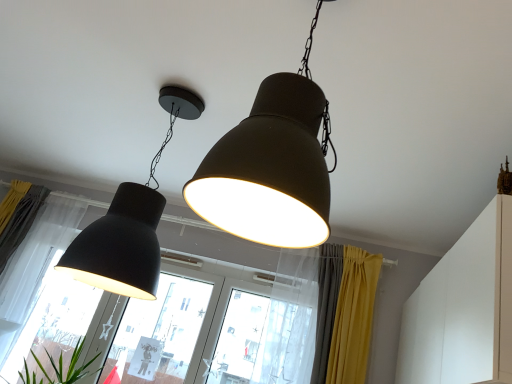
Measure the distance between point (158, 255) and camera.

The distance of point (158, 255) from camera is 3.03 meters.

This screenshot has height=384, width=512. Describe the element at coordinates (129, 223) in the screenshot. I see `matte black lampshade at left, the 1th lamp from the left` at that location.

Where is `matte black lampshade at left`? This screenshot has width=512, height=384. matte black lampshade at left is located at coordinates (161, 313).

The height and width of the screenshot is (384, 512). What are the coordinates of `white matte cabinet at upper right` in the screenshot? It's located at (463, 308).

Find the location of `white sheer curtain at left, which is the first curtain in left-to-right order`. white sheer curtain at left, which is the first curtain in left-to-right order is located at coordinates (21, 222).

The height and width of the screenshot is (384, 512). What do you see at coordinates (21, 222) in the screenshot? I see `white sheer curtain at left, arranged as the 3th curtain when viewed from the right` at bounding box center [21, 222].

Find the location of a particular element. The width and height of the screenshot is (512, 384). transparent glass window at lower left, which is counted as the third window, starting from the right is located at coordinates (52, 321).

The image size is (512, 384). Describe the element at coordinates (52, 321) in the screenshot. I see `transparent glass window at lower left, arranged as the first window when viewed from the left` at that location.

Find the location of a particular element. matte black lampshade at left, which ranks as the first lamp in back-to-front order is located at coordinates (129, 223).

From the image's perspective, is silky yellow curtain at center, the second curtain in the left-to-right sequence, located above or below white matte cabinet at upper right?

Clearly, from the image's perspective, silky yellow curtain at center, the second curtain in the left-to-right sequence, is below white matte cabinet at upper right.

Is silky yellow curtain at center, the second curtain in the left-to-right sequence, not near white matte cabinet at upper right?

Yes, silky yellow curtain at center, the second curtain in the left-to-right sequence, and white matte cabinet at upper right are quite far apart.

Which object is positioned more to the left, silky yellow curtain at center, the second curtain in the left-to-right sequence, or white matte cabinet at upper right?

silky yellow curtain at center, the second curtain in the left-to-right sequence, is more to the left.

Considering the sizes of objects silky yellow curtain at center, the second curtain in the left-to-right sequence, and white matte cabinet at upper right in the image provided, who is wider, silky yellow curtain at center, the second curtain in the left-to-right sequence, or white matte cabinet at upper right?

white matte cabinet at upper right is wider.

Is transparent glass window at center, arranged as the 3th window when viewed from the left, touching yellow fabric curtain at lower right, which is counted as the first curtain, starting from the right?

transparent glass window at center, arranged as the 3th window when viewed from the left, and yellow fabric curtain at lower right, which is counted as the first curtain, starting from the right, are clearly separated.

From a real-world perspective, is transparent glass window at center, arranged as the 3th window when viewed from the left, above or below yellow fabric curtain at lower right, which is counted as the first curtain, starting from the right?

transparent glass window at center, arranged as the 3th window when viewed from the left, is situated lower than yellow fabric curtain at lower right, which is counted as the first curtain, starting from the right, in the real world.

Considering the relative sizes of transparent glass window at center, the first window from the right, and yellow fabric curtain at lower right, arranged as the third curtain when viewed from the left, in the image provided, is transparent glass window at center, the first window from the right, taller than yellow fabric curtain at lower right, arranged as the third curtain when viewed from the left,?

No, transparent glass window at center, the first window from the right, is not taller than yellow fabric curtain at lower right, arranged as the third curtain when viewed from the left.

Considering the points (249, 347) and (355, 264), which point is in front, point (249, 347) or point (355, 264)?

The point (355, 264) is closer to the camera.

Looking at this image, between transparent glass window at center, acting as the second window starting from the left, and white matte cabinet at upper right, which one has larger width?

Wider between the two is white matte cabinet at upper right.

Are transparent glass window at center, which is the second window from right to left, and white matte cabinet at upper right far apart?

Yes, transparent glass window at center, which is the second window from right to left, and white matte cabinet at upper right are quite far apart.

Is point (169, 359) closer to viewer compared to point (473, 306)?

No, (169, 359) is behind (473, 306).

Is transparent glass window at center, acting as the second window starting from the left, to the left of white matte cabinet at upper right from the viewer's perspective?

Correct, you'll find transparent glass window at center, acting as the second window starting from the left, to the left of white matte cabinet at upper right.

Between matte black lampshade at left, the 1th lamp from the left, and yellow fabric curtain at lower right, which is counted as the first curtain, starting from the right, which one has smaller width?

yellow fabric curtain at lower right, which is counted as the first curtain, starting from the right.

Considering the points (158, 254) and (345, 364), which point is behind, point (158, 254) or point (345, 364)?

Point (158, 254)

Does matte black lampshade at left, which ranks as the first lamp in back-to-front order, have a greater height compared to yellow fabric curtain at lower right, arranged as the third curtain when viewed from the left?

Yes.

Are matte black lampshade at left, the 2th lamp when ordered from front to back, and yellow fabric curtain at lower right, arranged as the third curtain when viewed from the left, located far from each other?

Yes, matte black lampshade at left, the 2th lamp when ordered from front to back, and yellow fabric curtain at lower right, arranged as the third curtain when viewed from the left, are located far from each other.

From the image's perspective, which curtain is the 2nd one above the transparent glass window at center, which is the second window from right to left? Please provide its 2D coordinates.

[(326, 306)]

Is transparent glass window at center, which is the second window from right to left, turned away from silky yellow curtain at center, the second curtain in the left-to-right sequence?

No, transparent glass window at center, which is the second window from right to left, is not facing the opposite direction of silky yellow curtain at center, the second curtain in the left-to-right sequence.

Between transparent glass window at center, acting as the second window starting from the left, and silky yellow curtain at center, acting as the 2th curtain starting from the right, which one has less height?

Standing shorter between the two is silky yellow curtain at center, acting as the 2th curtain starting from the right.

From the picture: Considering the relative sizes of transparent glass window at center, which is the second window from right to left, and silky yellow curtain at center, acting as the 2th curtain starting from the right, in the image provided, is transparent glass window at center, which is the second window from right to left, thinner than silky yellow curtain at center, acting as the 2th curtain starting from the right,?

Yes.

Are white sheer curtain at left, arranged as the 3th curtain when viewed from the right, and transparent glass window at center, the first window from the right, far apart?

white sheer curtain at left, arranged as the 3th curtain when viewed from the right, is positioned a significant distance from transparent glass window at center, the first window from the right.

At what (x,y) coordinates should I click in order to perform the action: click on the 1st window below the white sheer curtain at left, which is the first curtain in left-to-right order (from a real-world perspective). Please return your answer as a coordinate pair (x, y). Looking at the image, I should click on (263, 342).

In the scene shown: Can transparent glass window at center, the first window from the right, be found inside white sheer curtain at left, which is the first curtain in left-to-right order?

Definitely not — transparent glass window at center, the first window from the right, is not inside white sheer curtain at left, which is the first curtain in left-to-right order.

Which is in front, white sheer curtain at left, which is the first curtain in left-to-right order, or transparent glass window at center, the first window from the right?

transparent glass window at center, the first window from the right, is closer to the camera.

Is silky yellow curtain at center, acting as the 2th curtain starting from the right, positioned far away from matte black lampshade at left, the 1th lamp from the left?

silky yellow curtain at center, acting as the 2th curtain starting from the right, is far away from matte black lampshade at left, the 1th lamp from the left.

Is silky yellow curtain at center, acting as the 2th curtain starting from the right, positioned behind matte black lampshade at left, which ranks as the first lamp in back-to-front order?

That is True.

Is matte black lampshade at left, the second lamp when ordered from right to left, located within silky yellow curtain at center, the second curtain in the left-to-right sequence?

No.

What are the coordinates of `the 2nd lamp counting from the left side of the silky yellow curtain at center, the second curtain in the left-to-right sequence` in the screenshot? It's located at (129, 223).

From the white matte cabinet at upper right, count 2nd curtains backward and point to it. Please provide its 2D coordinates.

[(326, 306)]

Which curtain is the 2nd one when counting from the front of the transparent glass window at center, the first window from the right? Please provide its 2D coordinates.

[(353, 317)]

When comparing their distances from transparent glass window at center, the first window from the right, does transparent glass window at lower left, arranged as the first window when viewed from the left, or transparent glass window at center, acting as the second window starting from the left, seem further?

transparent glass window at lower left, arranged as the first window when viewed from the left, is positioned further to the anchor transparent glass window at center, the first window from the right.

Based on their spatial positions, is transparent glass window at center, the first window from the right, or silky yellow curtain at center, acting as the 2th curtain starting from the right, further from transparent glass window at center, acting as the second window starting from the left?

Among the two, silky yellow curtain at center, acting as the 2th curtain starting from the right, is located further to transparent glass window at center, acting as the second window starting from the left.

When comparing their distances from white sheer curtain at left, arranged as the 3th curtain when viewed from the right, does transparent glass window at lower left, which is counted as the third window, starting from the right, or silky yellow curtain at center, the second curtain in the left-to-right sequence, seem closer?

The object closer to white sheer curtain at left, arranged as the 3th curtain when viewed from the right, is transparent glass window at lower left, which is counted as the third window, starting from the right.

Considering their positions, is white matte cabinet at upper right positioned closer to transparent glass window at center, the first window from the right, than silky yellow curtain at center, the second curtain in the left-to-right sequence?

silky yellow curtain at center, the second curtain in the left-to-right sequence, is positioned closer to the anchor transparent glass window at center, the first window from the right.

Based on their spatial positions, is yellow fabric curtain at lower right, which is counted as the first curtain, starting from the right, or white sheer curtain at left, arranged as the 3th curtain when viewed from the right, further from matte black lampshade at left?

The object further to matte black lampshade at left is white sheer curtain at left, arranged as the 3th curtain when viewed from the right.

From the image, which object appears to be farther from yellow fabric curtain at lower right, arranged as the third curtain when viewed from the left, silky yellow curtain at center, acting as the 2th curtain starting from the right, or transparent glass window at center, acting as the second window starting from the left?

transparent glass window at center, acting as the second window starting from the left, is further to yellow fabric curtain at lower right, arranged as the third curtain when viewed from the left.

When comparing their distances from transparent glass window at center, arranged as the 3th window when viewed from the left, does matte black lampshade at left or white sheer curtain at left, arranged as the 3th curtain when viewed from the right, seem closer?

Among the two, matte black lampshade at left is located nearer to transparent glass window at center, arranged as the 3th window when viewed from the left.

Estimate the real-world distances between objects in this image. Which object is further from white matte cabinet at upper right, transparent glass window at lower left, arranged as the first window when viewed from the left, or matte black lampshade at left?

transparent glass window at lower left, arranged as the first window when viewed from the left, lies further to white matte cabinet at upper right than the other object.

Locate an element on the screen. This screenshot has height=384, width=512. window between transparent glass window at lower left, arranged as the first window when viewed from the left, and transparent glass window at center, arranged as the 3th window when viewed from the left, in the horizontal direction is located at coordinates (158, 334).

You are a GUI agent. You are given a task and a screenshot of the screen. Output one action in this format:
    pyautogui.click(x=<x>, y=<y>)
    Task: Click on the bay window between matte black lampshade at left, which ranks as the first lamp in back-to-front order, and white sheer curtain at left, arranged as the 3th curtain when viewed from the right, along the z-axis
    This screenshot has width=512, height=384.
    Given the screenshot: What is the action you would take?
    pyautogui.click(x=161, y=313)

I want to click on window between transparent glass window at center, acting as the second window starting from the left, and silky yellow curtain at center, the second curtain in the left-to-right sequence, so click(x=263, y=342).

At what (x,y) coordinates should I click in order to perform the action: click on bay window situated between white sheer curtain at left, arranged as the 3th curtain when viewed from the right, and yellow fabric curtain at lower right, arranged as the third curtain when viewed from the left, from left to right. Please return your answer as a coordinate pair (x, y). The width and height of the screenshot is (512, 384). Looking at the image, I should click on pyautogui.click(x=161, y=313).